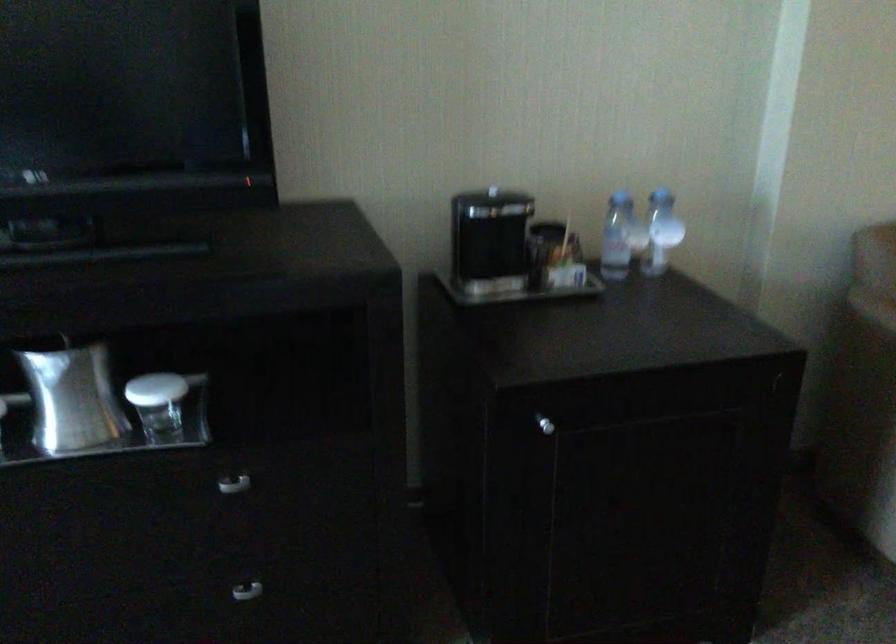
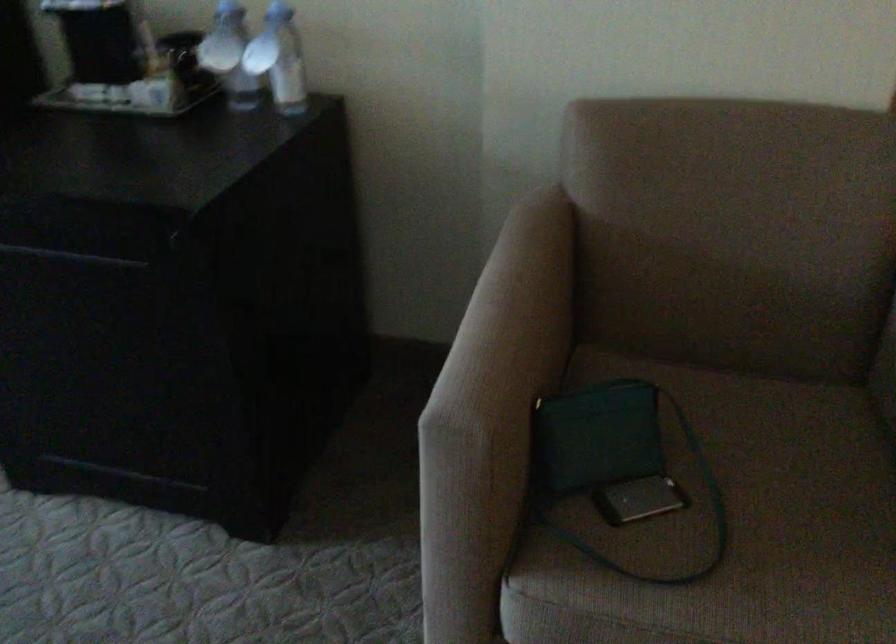
Which direction would the cameraman need to move to produce the second image?

The movement direction of the cameraman is right, forward.